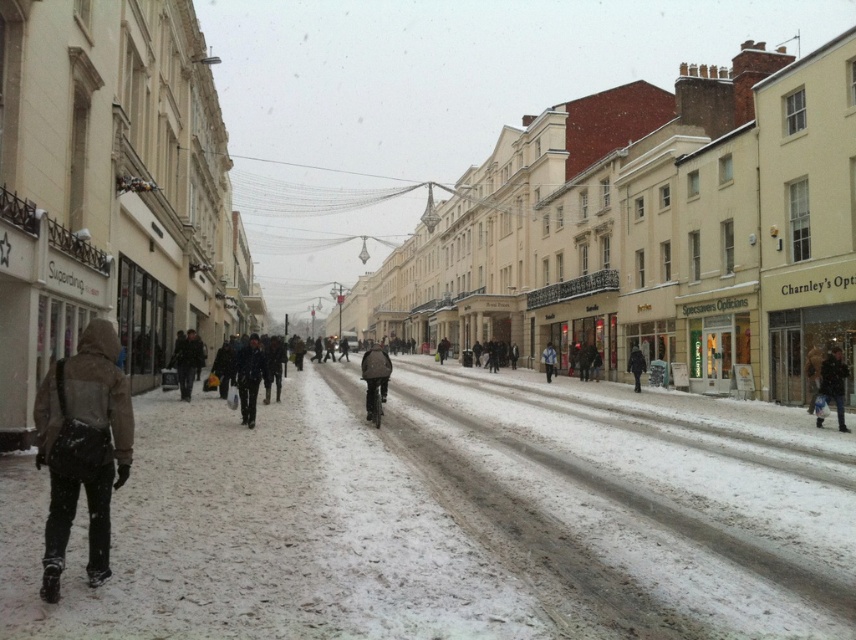
Which is more to the left, white powdery snow at lower left or dark brown leather jacket at center?

dark brown leather jacket at center

Looking at this image, between white powdery snow at lower left and dark brown leather jacket at center, which one is positioned higher?

dark brown leather jacket at center is higher up.

Is point (580, 400) farther from viewer compared to point (378, 420)?

Yes, point (580, 400) is behind point (378, 420).

Locate an element on the screen. The image size is (856, 640). white powdery snow at lower left is located at coordinates (456, 516).

Does white powdery snow at lower left have a lesser height compared to blue denim jacket at center?

Yes, white powdery snow at lower left is shorter than blue denim jacket at center.

From the picture: Is white powdery snow at lower left below blue denim jacket at center?

Yes, white powdery snow at lower left is below blue denim jacket at center.

Does point (681, 589) come in front of point (551, 353)?

That is True.

The width and height of the screenshot is (856, 640). I want to click on white powdery snow at lower left, so click(x=456, y=516).

Describe the element at coordinates (82, 448) in the screenshot. I see `brown fuzzy jacket at left` at that location.

Between point (91, 349) and point (245, 356), which one is positioned in front?

Point (91, 349)

Image resolution: width=856 pixels, height=640 pixels. Identify the location of brown fuzzy jacket at left. (82, 448).